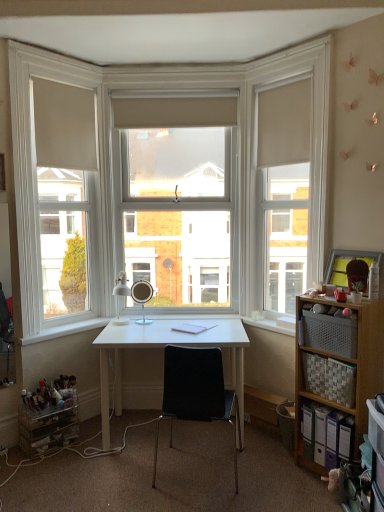
Question: Does point (46, 58) appear closer or farther from the camera than point (167, 247)?

Choices:
 (A) farther
 (B) closer

Answer: (B)

Question: From the image's perspective, is white matte window frame at left, the first window frame from the left, above or below clear glass window at center?

Choices:
 (A) above
 (B) below

Answer: (B)

Question: Estimate the real-world distances between objects in this image. Which object is farther from the woven fabric basket at right, placed as the 2th shelf when sorted from bottom to top?

Choices:
 (A) matte white table lamp at center, arranged as the 2th table lamp when viewed from the right
 (B) woven fabric basket at right
 (C) white glossy desk at center
 (D) wooden shelf at right, marked as the 1th shelf in a bottom-to-top arrangement
 (E) clear glass window at center

Answer: (E)

Question: Based on their relative distances, which object is farther from the black plastic chair at center?

Choices:
 (A) white glossy desk at center
 (B) woven fabric basket at right
 (C) woven fabric basket at right, placed as the 2th shelf when sorted from bottom to top
 (D) white matte window frame at left, the first window frame from the left
 (E) matte white table lamp at center, arranged as the 2th table lamp when viewed from the right

Answer: (D)